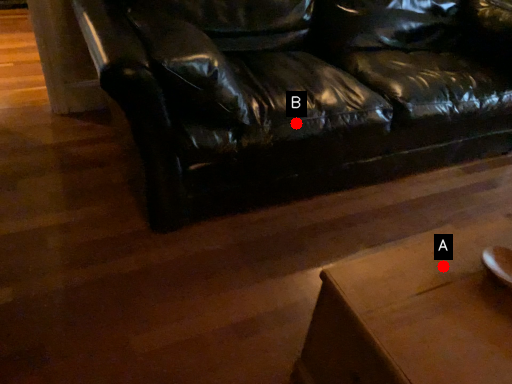
Question: Two points are circled on the image, labeled by A and B beside each circle. Among these points, which one is nearest to the camera?

Choices:
 (A) A is closer
 (B) B is closer

Answer: (A)